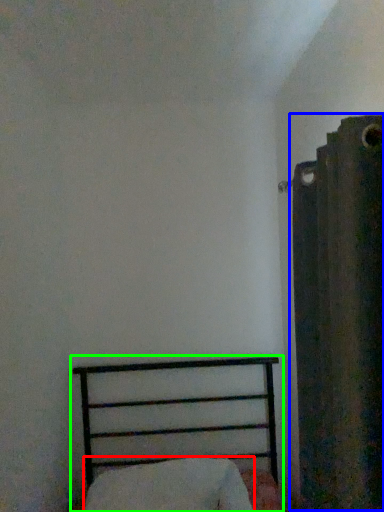
Question: Estimate the real-world distances between objects in this image. Which object is closer to pillow (highlighted by a red box), curtain (highlighted by a blue box) or bed (highlighted by a green box)?

Choices:
 (A) curtain
 (B) bed

Answer: (B)